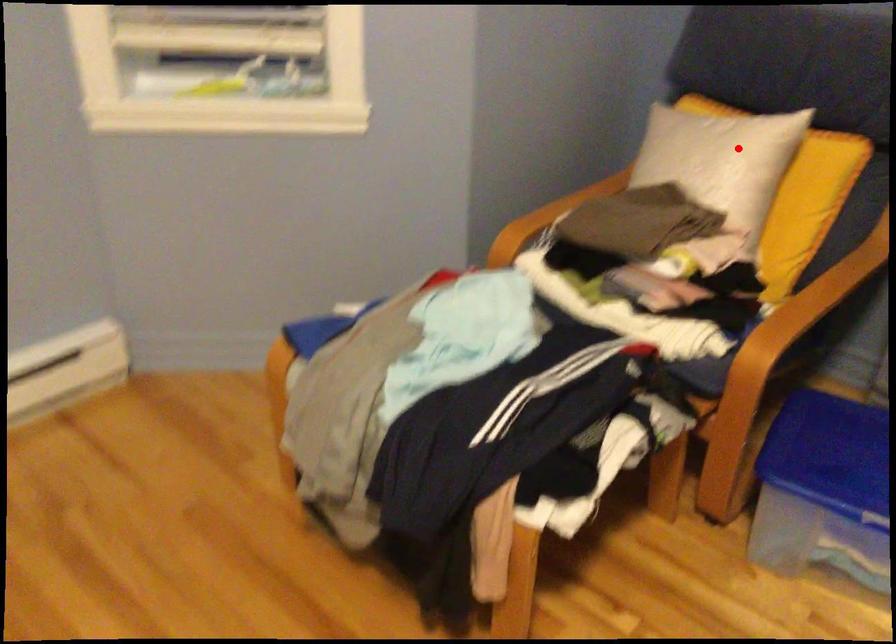
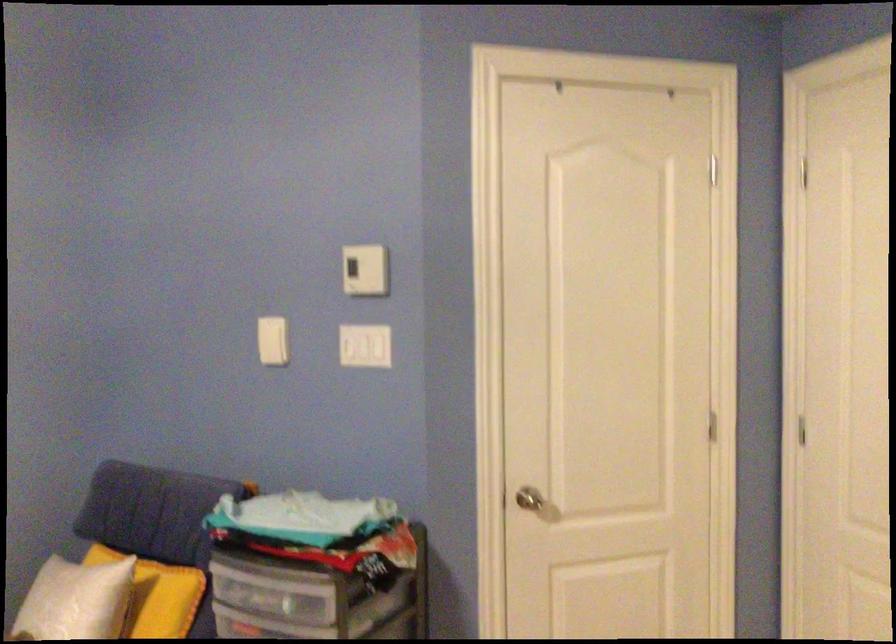
Question: A red point is marked in image1. In image2, is the corresponding 3D point closer to the camera or farther? Reply with the corresponding letter.

Choices:
 (A) The corresponding 3D point is closer.
 (B) The corresponding 3D point is farther.

Answer: (B)